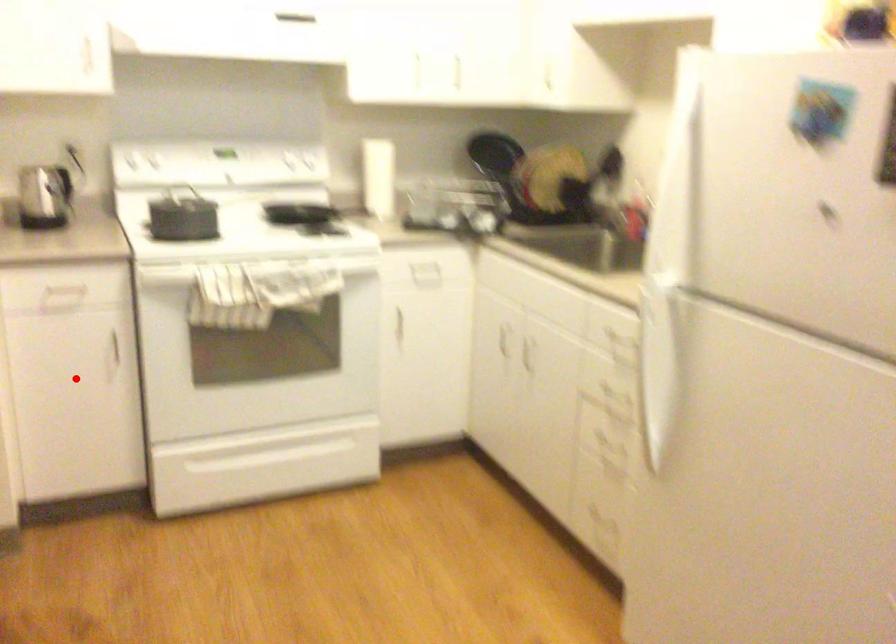
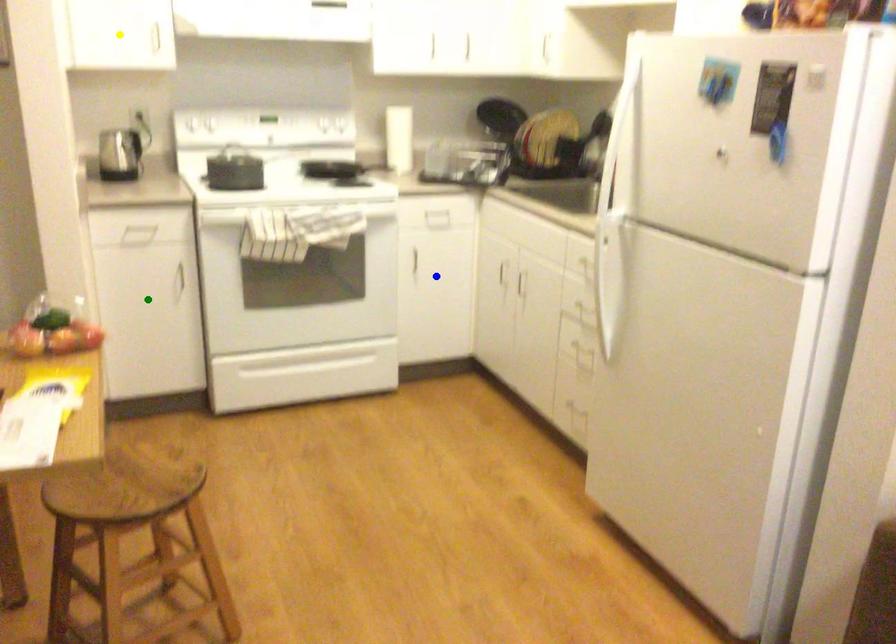
Question: I am providing you with two images of the same scene from different viewpoints. A red point is marked on the first image. You are given multiple points on the second image. Which mark in image 2 goes with the point in image 1?

Choices:
 (A) blue point
 (B) green point
 (C) yellow point

Answer: (B)